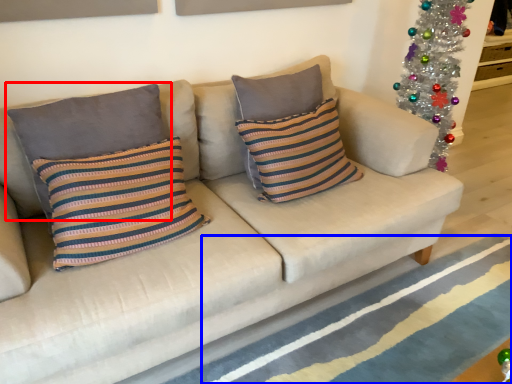
Question: Which point is closer to the camera, pillow (highlighted by a red box) or stripe (highlighted by a blue box)?

Choices:
 (A) pillow
 (B) stripe

Answer: (B)